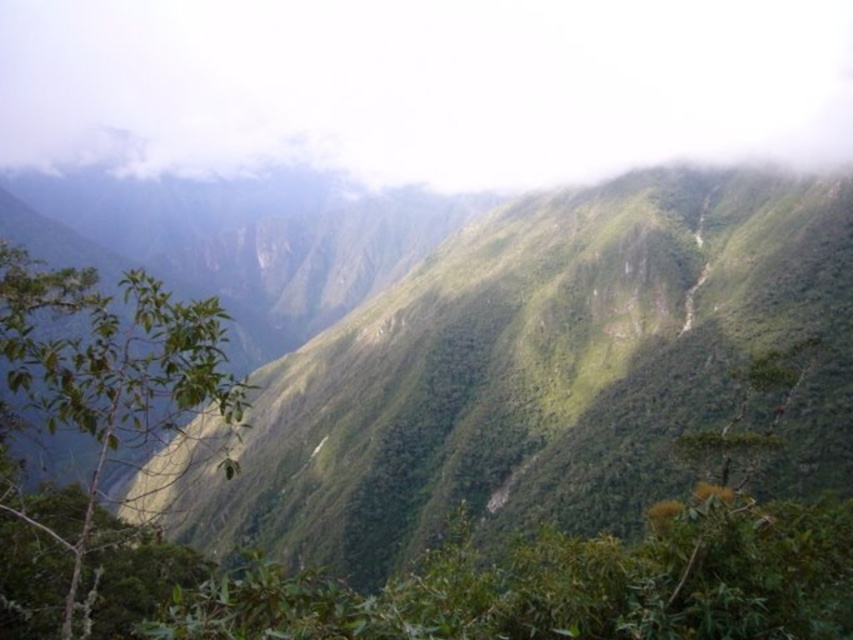
You are an artist sketching the mountain landscape. You want to ensure the white fluffy cloud at upper center and the green leafy branch at lower left are proportionally accurate. Which object should you draw wider?

The white fluffy cloud at upper center should be drawn wider since its width surpasses that of the green leafy branch at lower left according to the description.

Looking at this image, you are an airplane pilot flying at an altitude of 10,000 feet. You notice a white fluffy cloud at upper center located at point (425, 84). Can you safely navigate your plane around this cloud without encountering turbulence?

The white fluffy cloud at upper center at point (425, 84) is a cumulus cloud, which typically indicates fair weather. Since cumulus clouds are generally not associated with severe turbulence, you can safely navigate around the cloud. However, always exercise caution and monitor weather conditions closely.